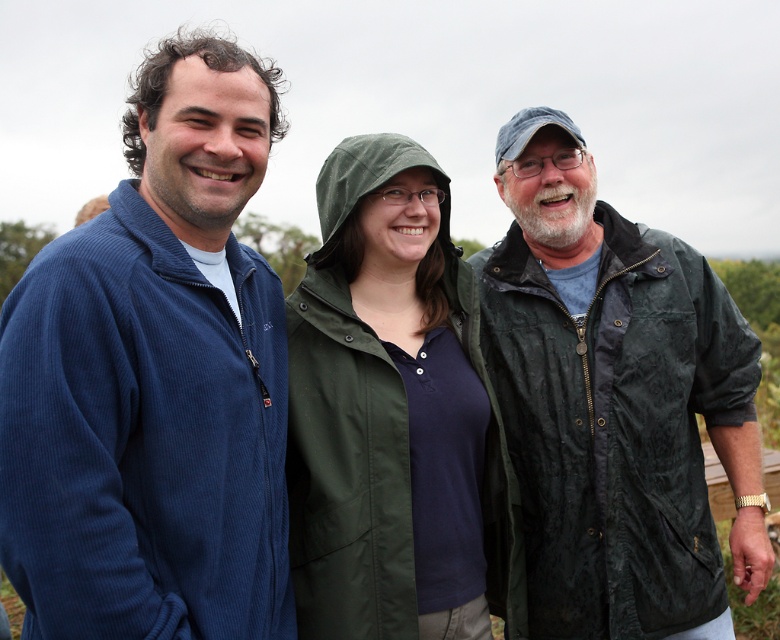
Question: Considering the relative positions of corduroy blue jacket at left and dark green waxed jacket at right in the image provided, where is corduroy blue jacket at left located with respect to dark green waxed jacket at right?

Choices:
 (A) left
 (B) right

Answer: (A)

Question: Where is dark green waxed jacket at right located in relation to green fabric jacket at center in the image?

Choices:
 (A) below
 (B) above

Answer: (B)

Question: Is corduroy blue jacket at left to the left of dark green waxed jacket at right from the viewer's perspective?

Choices:
 (A) no
 (B) yes

Answer: (B)

Question: Which object is closer to the camera taking this photo?

Choices:
 (A) green fabric jacket at center
 (B) corduroy blue jacket at left

Answer: (B)

Question: Estimate the real-world distances between objects in this image. Which object is farther from the corduroy blue jacket at left?

Choices:
 (A) green fabric jacket at center
 (B) dark green waxed jacket at right

Answer: (B)

Question: Which object appears farthest from the camera in this image?

Choices:
 (A) dark green waxed jacket at right
 (B) corduroy blue jacket at left

Answer: (A)